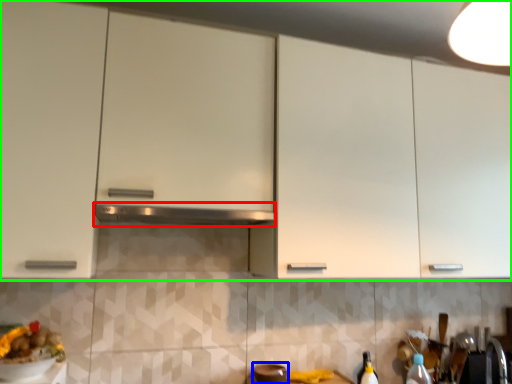
Question: Which is farther away from exhaust hood (highlighted by a red box)? appliance (highlighted by a blue box) or cabinetry (highlighted by a green box)?

Choices:
 (A) appliance
 (B) cabinetry

Answer: (A)